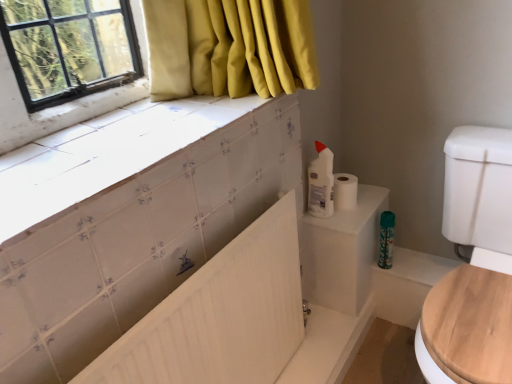
Question: From a real-world perspective, is white glossy tile at upper left above or below white matte toilet paper at upper right?

Choices:
 (A) below
 (B) above

Answer: (B)

Question: Looking at their shapes, would you say white glossy tile at upper left is wider or thinner than white matte toilet paper at upper right?

Choices:
 (A) wide
 (B) thin

Answer: (A)

Question: Estimate the real-world distances between objects in this image. Which object is farther from the wooden at right?

Choices:
 (A) green plastic spray bottle at lower right, the 1th cleaning product from the right
 (B) white plastic bottle at upper right, which is counted as the 1th cleaning product, starting from the top
 (C) white glossy tile at upper left
 (D) white matte radiator at center
 (E) white matte toilet paper at upper right

Answer: (C)

Question: Considering the real-world distances, which object is farthest from the white glossy tile at upper left?

Choices:
 (A) green plastic spray bottle at lower right, which is the 1th cleaning product in back-to-front order
 (B) white matte radiator at center
 (C) wooden at right
 (D) white plastic bottle at upper right, which is counted as the 1th cleaning product, starting from the top
 (E) white matte toilet paper at upper right

Answer: (A)